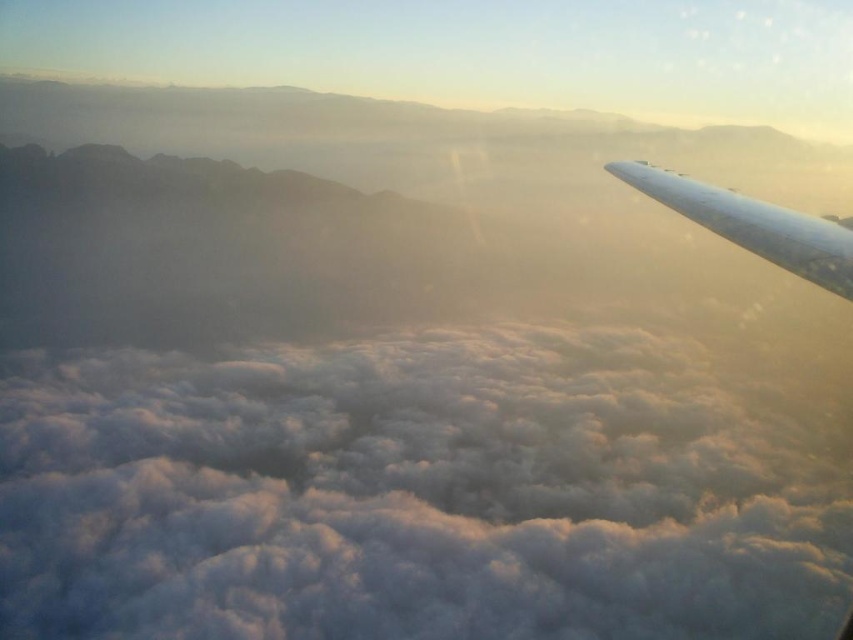
Between white fluffy cloud at center and white glossy wing at upper right, which one appears on the right side from the viewer's perspective?

From the viewer's perspective, white glossy wing at upper right appears more on the right side.

Is the position of white fluffy cloud at center less distant than that of white glossy wing at upper right?

No, white fluffy cloud at center is behind white glossy wing at upper right.

Between point (416, 614) and point (701, 186), which one is positioned behind?

The point (416, 614) is behind.

Identify the location of white fluffy cloud at center. (409, 496).